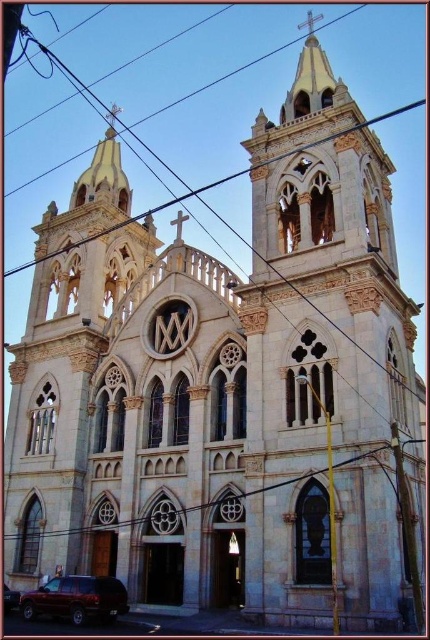
Is maroon matte suv at lower left shorter than matte black suv at lower left?

In fact, maroon matte suv at lower left may be taller than matte black suv at lower left.

Is point (104, 596) less distant than point (5, 588)?

Yes, it is in front of point (5, 588).

Where is `maroon matte suv at lower left`? The width and height of the screenshot is (430, 640). maroon matte suv at lower left is located at coordinates (76, 600).

Consider the image. Which is more to the left, white stone tower at center or maroon matte suv at lower left?

From the viewer's perspective, maroon matte suv at lower left appears more on the left side.

Between point (303, 227) and point (49, 582), which one is positioned in front?

Positioned in front is point (49, 582).

Does point (365, 248) lie in front of point (51, 602)?

No, (365, 248) is behind (51, 602).

Where is `white stone tower at center`? white stone tower at center is located at coordinates (322, 356).

Which is more to the right, white stone tower at center or matte black suv at lower left?

white stone tower at center

Image resolution: width=430 pixels, height=640 pixels. What are the coordinates of `white stone tower at center` in the screenshot? It's located at (322, 356).